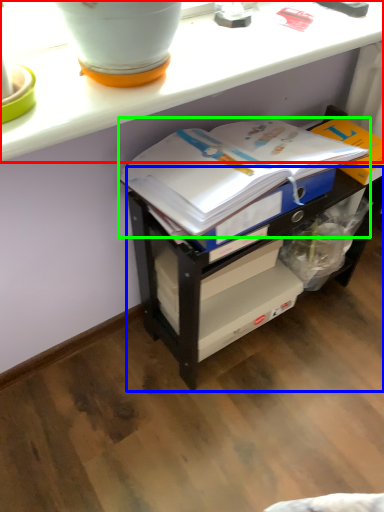
Question: Which is nearer to the counter (highlighted by a red box)? shelf (highlighted by a blue box) or journal (highlighted by a green box).

Choices:
 (A) shelf
 (B) journal

Answer: (B)